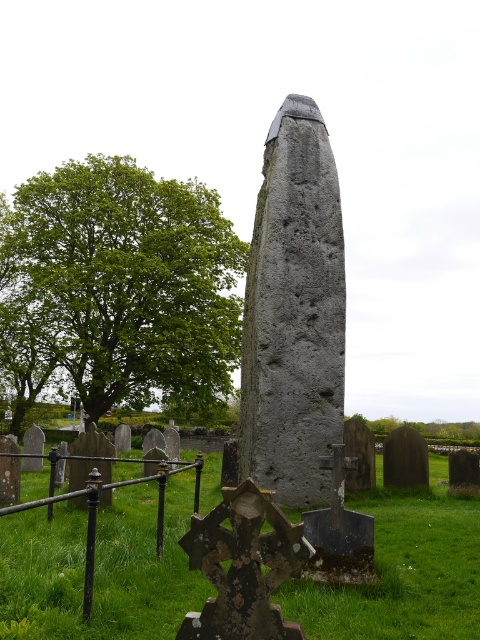
Question: Can you confirm if green grass at center is positioned below green leafy tree at upper left?

Choices:
 (A) yes
 (B) no

Answer: (A)

Question: Does green grass at center appear over green leafy tree at upper left?

Choices:
 (A) yes
 (B) no

Answer: (B)

Question: Which point appears closest to the camera in this image?

Choices:
 (A) (217, 484)
 (B) (159, 180)

Answer: (A)

Question: Observing the image, what is the correct spatial positioning of green grass at center in reference to green leafy tree at upper left?

Choices:
 (A) below
 (B) above

Answer: (A)

Question: Which point is closer to the camera taking this photo?

Choices:
 (A) (86, 372)
 (B) (13, 560)

Answer: (B)

Question: Which of the following is the closest to the observer?

Choices:
 (A) (122, 250)
 (B) (7, 570)

Answer: (B)